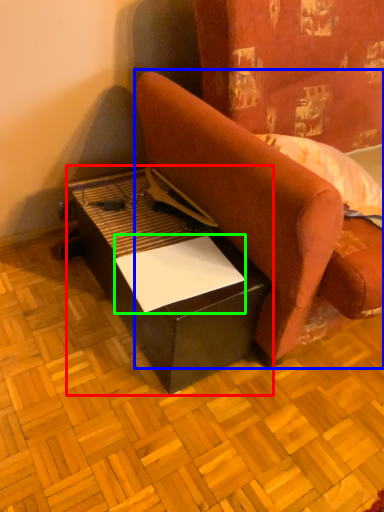
Question: Which object is positioned farthest from table (highlighted by a red box)? Select from studio couch (highlighted by a blue box) and paper (highlighted by a green box).

Choices:
 (A) studio couch
 (B) paper

Answer: (A)